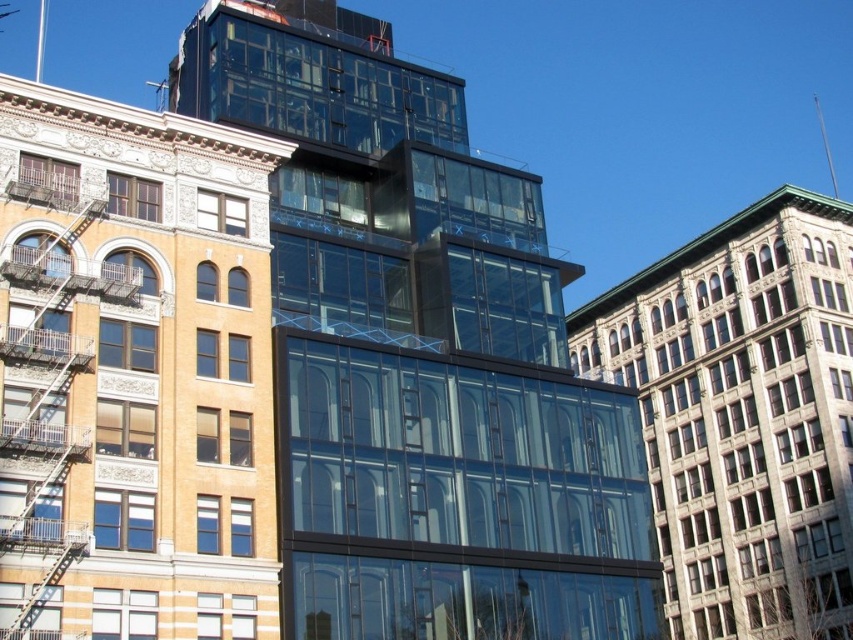
Looking at this image, you are standing at the center of the image and want to locate the transparent glass building at center. What are the coordinates where you should look?

The transparent glass building at center is located at coordinates point (x=421, y=355).

You are a window cleaner who needs to clean both the transparent glass building at center and the metallic silver fire escape at left. Which object should you tackle first if you want to start from the lowest point?

You should clean the metallic silver fire escape at left first because the transparent glass building at center is located above it, meaning the fire escape is lower in position.